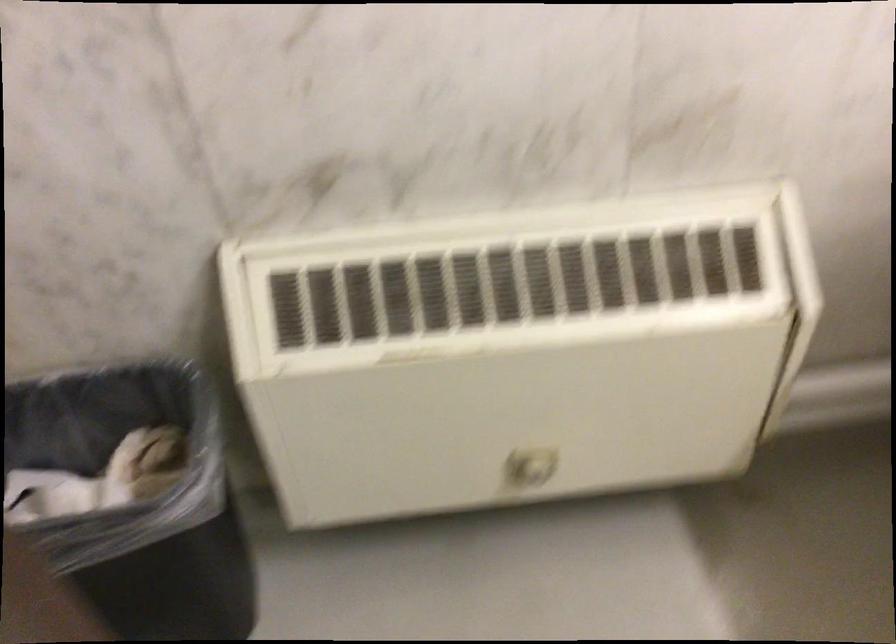
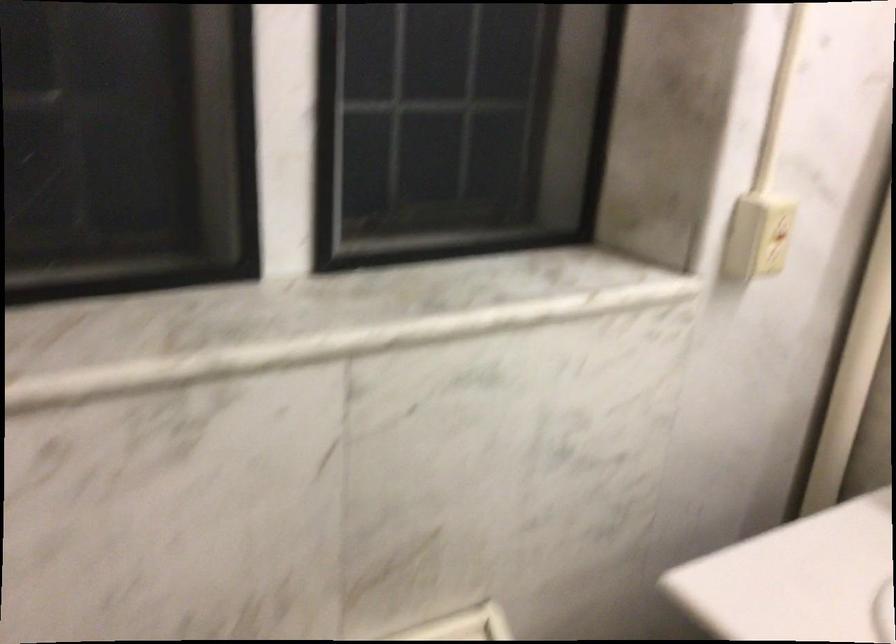
How did the camera likely rotate?

The camera rotated toward right-up.